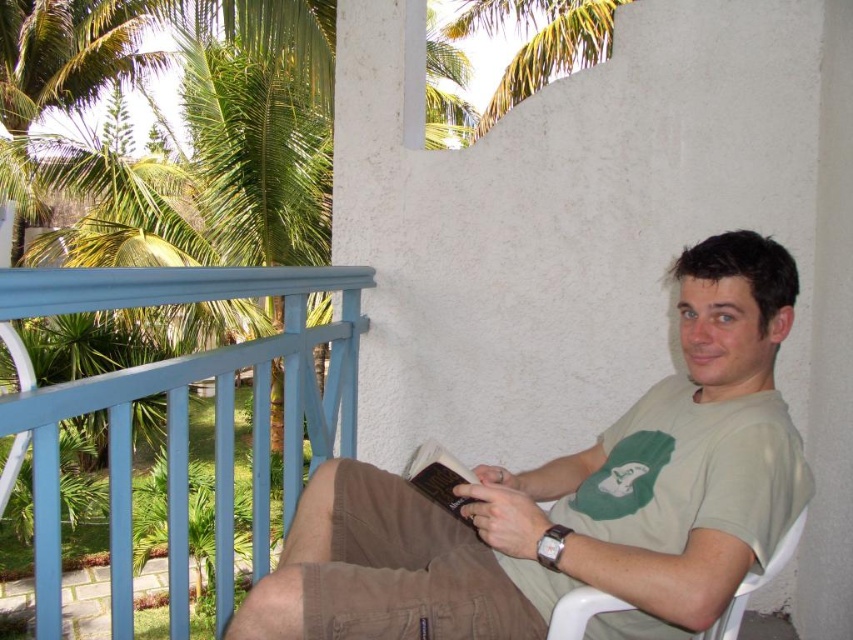
In the scene shown: You are standing on the balcony and want to place a new potted plant between the blue painted wood railing at left and the hardcover book at center. Which object should you place it closer to if you want the plant to be closer to the railing?

The blue painted wood railing at left is positioned on the left side of the hardcover book at center. To place the plant closer to the railing, position it near the blue painted wood railing at left.